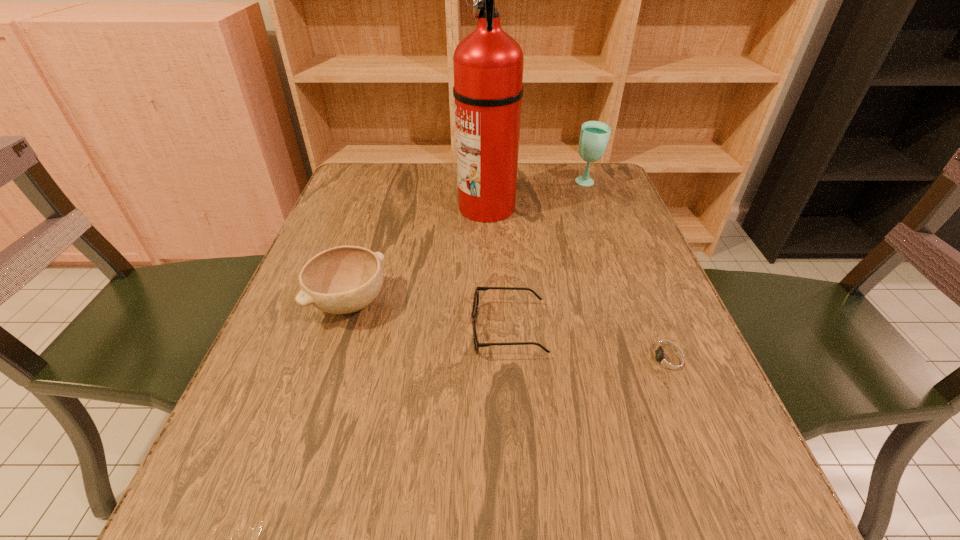
Locate an element on the screen. the second closest object to the leftmost object is located at coordinates tap(488, 63).

At what (x,y) coordinates should I click in order to perform the action: click on free space in the image that satisfies the following two spatial constraints: 1. on the front side of the second tallest object; 2. on the front-facing side of the second shortest object. Please return your answer as a coordinate pair (x, y). The height and width of the screenshot is (540, 960). Looking at the image, I should click on (641, 330).

Locate an element on the screen. The image size is (960, 540). vacant area that satisfies the following two spatial constraints: 1. at the nozzle of the tallest object; 2. on the front side of the leftmost object is located at coordinates (489, 303).